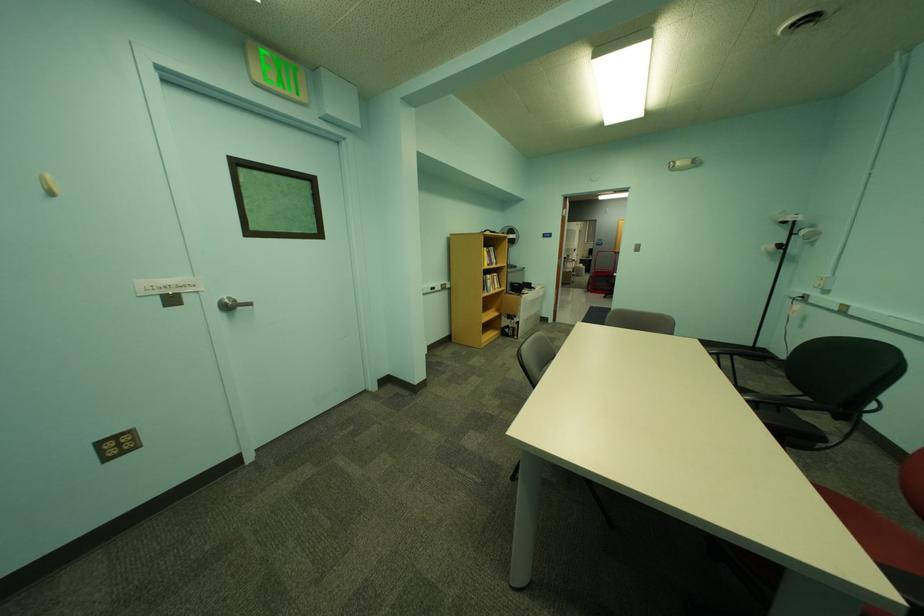
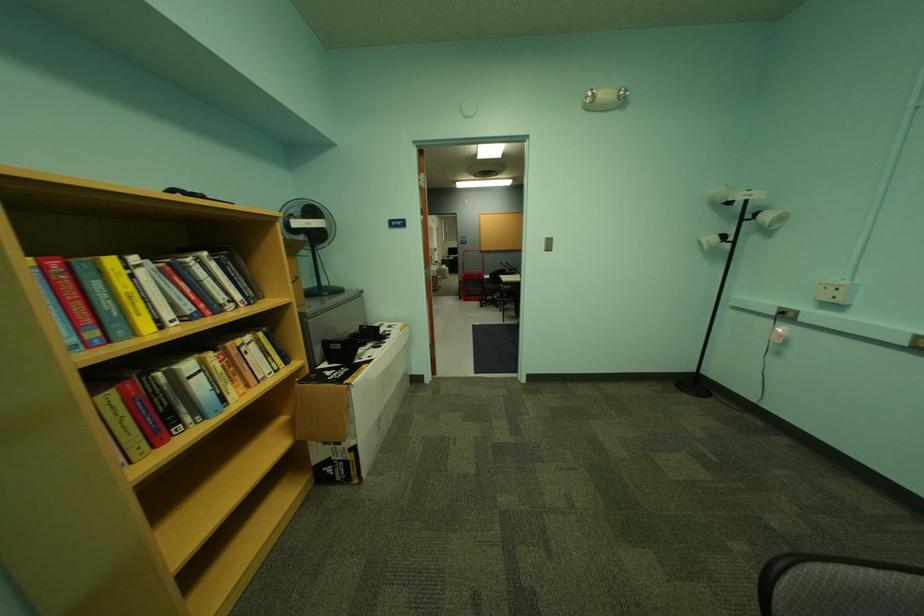
The point at (601, 249) is marked in the first image. Where is the corresponding point in the second image?

(466, 249)